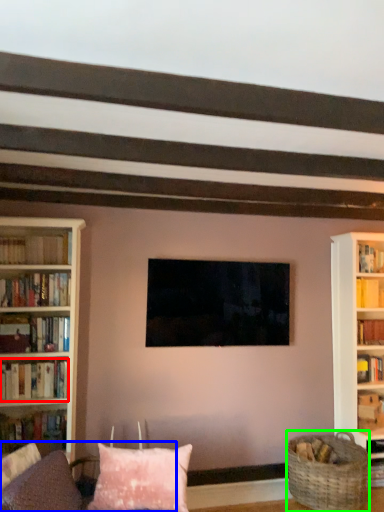
Question: Estimate the real-world distances between objects in this image. Which object is farther from book (highlighted by a red box), couch (highlighted by a blue box) or basket (highlighted by a green box)?

Choices:
 (A) couch
 (B) basket

Answer: (B)